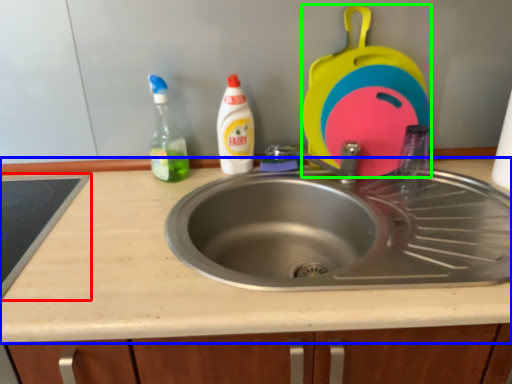
Question: Which object is the closest to the appliance (highlighted by a red box)? Choose among these: countertop (highlighted by a blue box) or appliance (highlighted by a green box).

Choices:
 (A) countertop
 (B) appliance

Answer: (A)